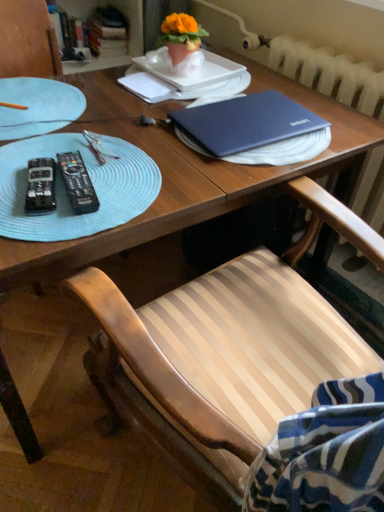
Question: Is orange matte flower pot at upper center wider or thinner than black plastic remote control at left, the 2th remote control when ordered from right to left?

Choices:
 (A) wide
 (B) thin

Answer: (A)

Question: From the image's perspective, is orange matte flower pot at upper center located above or below black plastic remote control at left, the 2th remote control when ordered from right to left?

Choices:
 (A) below
 (B) above

Answer: (B)

Question: Estimate the real-world distances between objects in this image. Which object is closer to the hardcover book at upper left, the second book in the left-to-right sequence?

Choices:
 (A) white textured radiator at upper right
 (B) blue woven placemat at left, which is the first glass plate from bottom to top
 (C) light blue textured glass plate at left, the 1th glass plate in the top-to-bottom sequence
 (D) black plastic remote control at left, the 2th remote control when ordered from right to left
 (E) black plastic remote control at left, which is counted as the second remote control, starting from the left

Answer: (A)

Question: Estimate the real-world distances between objects in this image. Which object is farther from the white textured radiator at upper right?

Choices:
 (A) blue woven placemat at left, which is the first glass plate from bottom to top
 (B) orange matte flower pot at upper center
 (C) light blue textured glass plate at left, the 1th glass plate in the top-to-bottom sequence
 (D) white paper at upper center
 (E) hardcover book at upper left, the second book in the left-to-right sequence

Answer: (E)